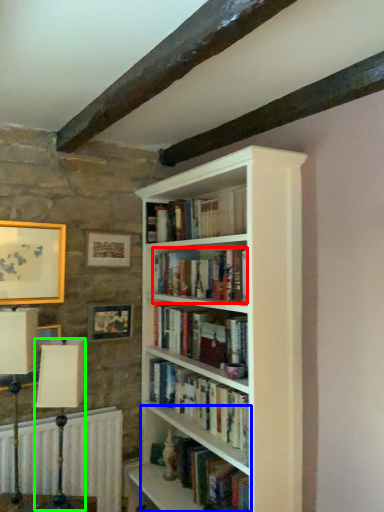
Question: Which object is the farthest from book (highlighted by a red box)? Choose among these: shelf (highlighted by a blue box) or table lamp (highlighted by a green box).

Choices:
 (A) shelf
 (B) table lamp

Answer: (B)